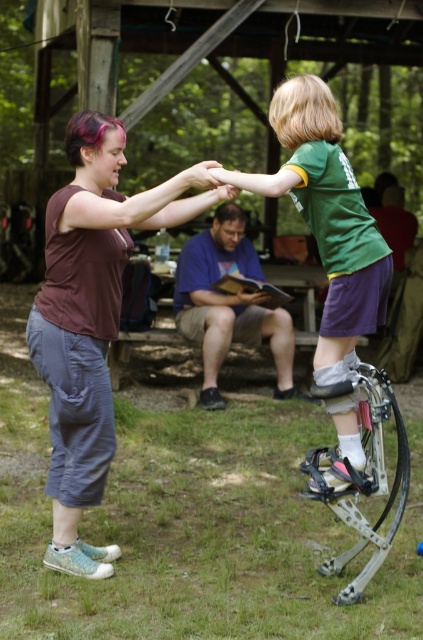
You are standing in the outdoor scene and want to greet both the green fabric shirt at upper center and the purple cotton shirt at center. Which one should you approach first to be closer?

You should approach the green fabric shirt at upper center first because it is closer to you than the purple cotton shirt at center.

You are a photographer standing at the picnic table. You want to take a photo of the green fabric shirt at upper center and the purple cotton shirt at center. Can you fit both subjects in the frame of your camera, which has a maximum field of view of 3 meters?

The distance between the green fabric shirt at upper center and the purple cotton shirt at center is 3.57 meters, which exceeds the camera field of view of 3 meters. Therefore, both subjects cannot be captured in a single frame.

You are standing in the scene and need to hand a water bottle to both the matte brown tank top at center and the purple cotton shirt at center. Which person should you approach first if you want to give the water bottle to the one closer to your left?

The matte brown tank top at center is to the left of the purple cotton shirt at center, so you should approach the matte brown tank top at center first since it is closer to your left.